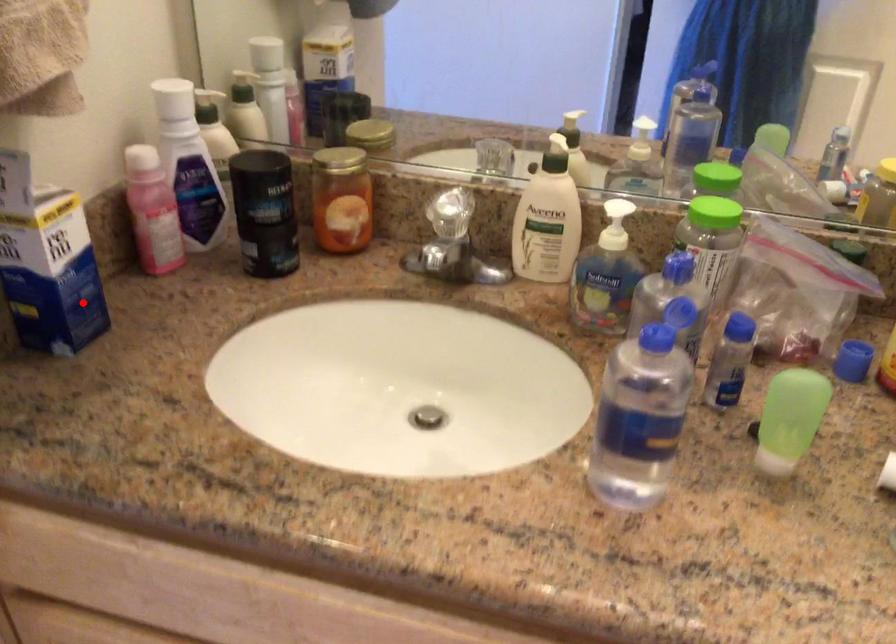
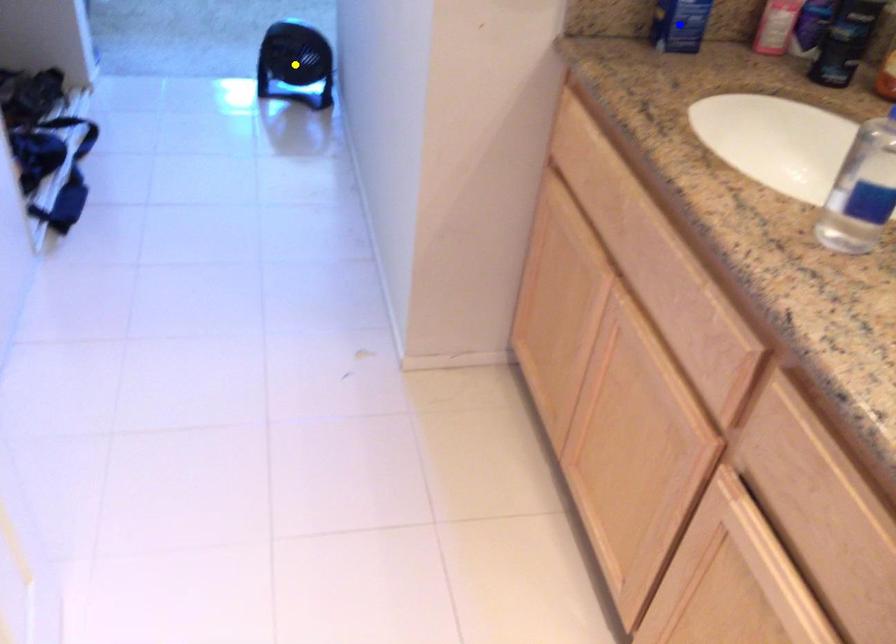
Question: I am providing you with two images of the same scene from different viewpoints. A red point is marked on the first image. You are given multiple points on the second image. In image 2, which mark is for the same physical point as the one in image 1?

Choices:
 (A) green point
 (B) blue point
 (C) yellow point

Answer: (B)